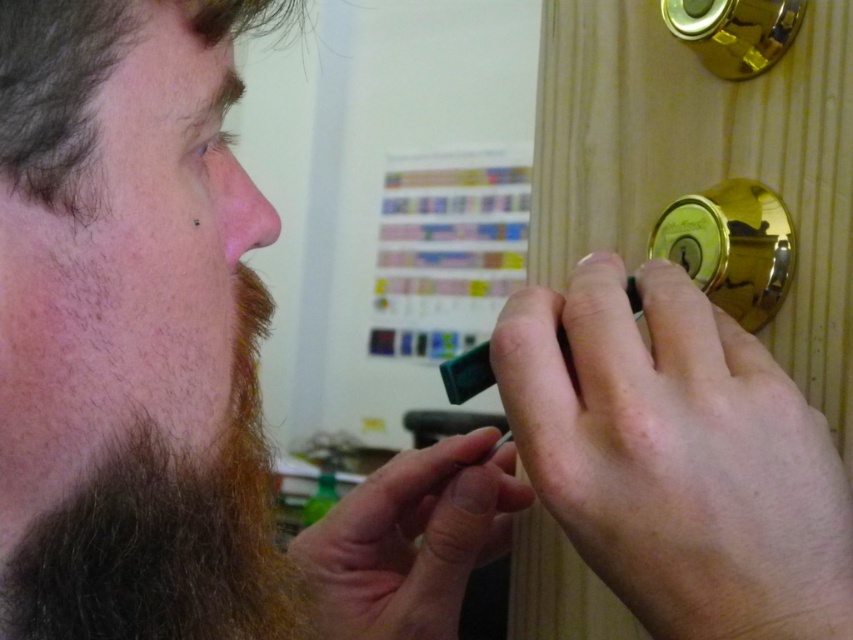
Is matte black eraser at upper center above smooth gold doorknob at right?

Incorrect, matte black eraser at upper center is not positioned above smooth gold doorknob at right.

How distant is matte black eraser at upper center from smooth gold doorknob at right?

The distance of matte black eraser at upper center from smooth gold doorknob at right is 6.23 inches.

Which is in front, point (74, 208) or point (749, 356)?

Point (74, 208) is in front.

Identify the location of matte black eraser at upper center. (177, 364).

Does smooth gold doorknob at right have a larger size compared to brown fuzzy beard at lower left?

Answer: No.

Does point (590, 371) come in front of point (38, 525)?

No, (590, 371) is behind (38, 525).

Is point (587, 296) in front of point (77, 618)?

No, (587, 296) is behind (77, 618).

The height and width of the screenshot is (640, 853). Identify the location of smooth gold doorknob at right. (677, 458).

Measure the distance from smooth gold doorknob at right to gold metallic door handle at right.

smooth gold doorknob at right and gold metallic door handle at right are 2.94 inches apart.

Is point (660, 413) farther from viewer compared to point (647, 248)?

No, it is not.

Is point (645, 483) in front of point (733, 269)?

That is True.

Find the location of `smooth gold doorknob at right`. smooth gold doorknob at right is located at coordinates (677, 458).